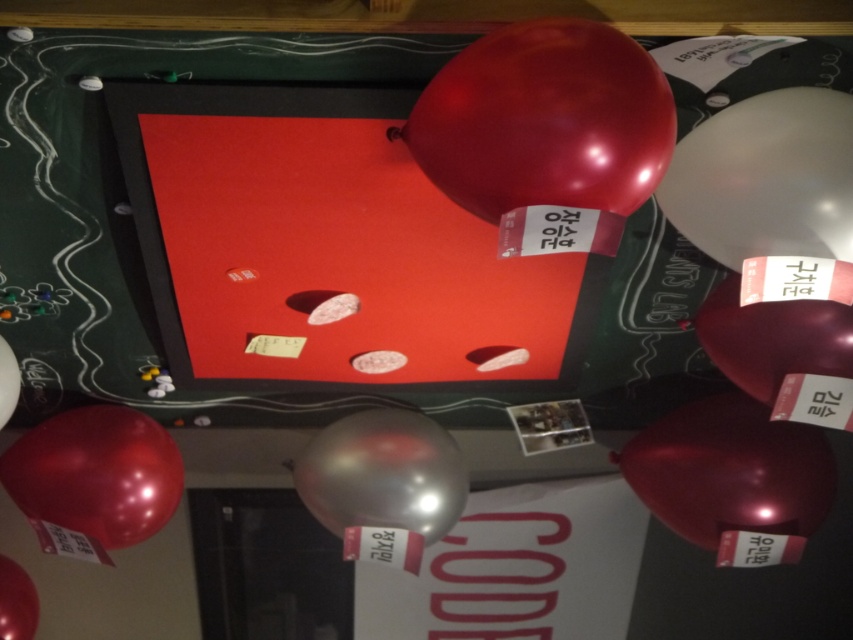
Consider the image. You are standing in front of the festive setup and want to touch the balloons. Which balloon, the glossy red balloon at upper center or the glossy metallic balloon at lower left, is easier to reach?

The glossy red balloon at upper center is closer to the viewer than the glossy metallic balloon at lower left, so it is easier to reach.

You are standing in front of the festive setup and notice two balloons. The metallic red balloon at lower right and the glossy metallic balloon at lower left. Which balloon is positioned more to the east side of the setup?

The metallic red balloon at lower right is positioned more to the east side of the setup because it is to the right of the glossy metallic balloon at lower left.

You are standing in front of the festive setup and want to place a new decoration between the two points, point (677, 216) and point (759, 342). Which point should the decoration be closer to in order to be in front?

The decoration should be closer to point (677, 216) because it is in front of point (759, 342).